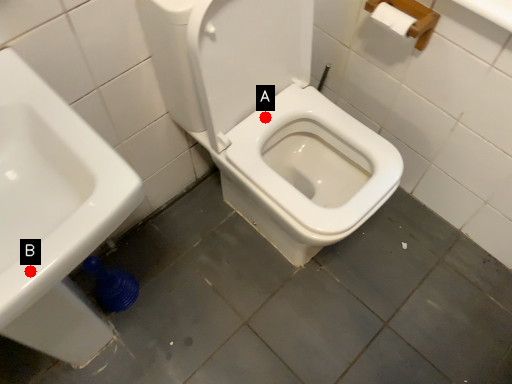
Question: Two points are circled on the image, labeled by A and B beside each circle. Among these points, which one is nearest to the camera?

Choices:
 (A) A is closer
 (B) B is closer

Answer: (B)